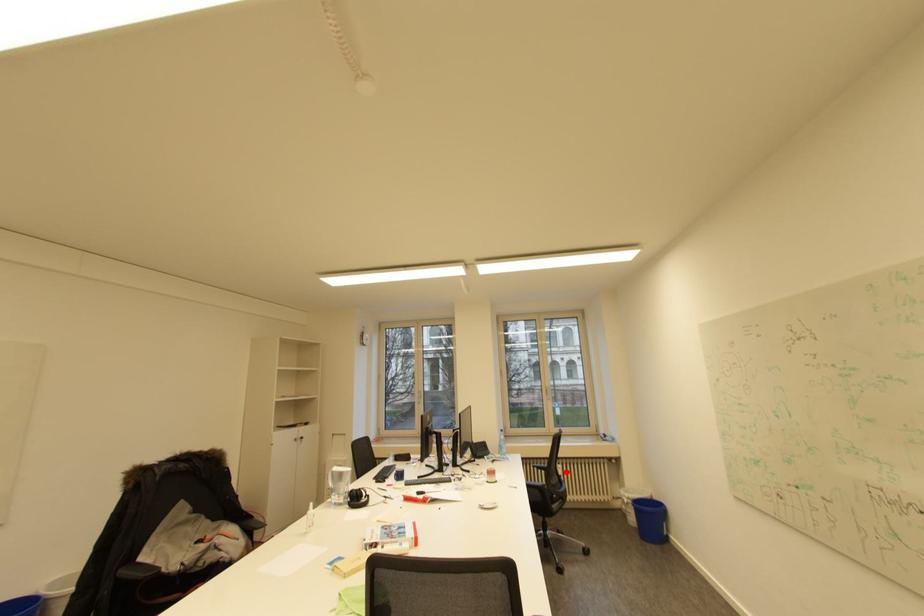
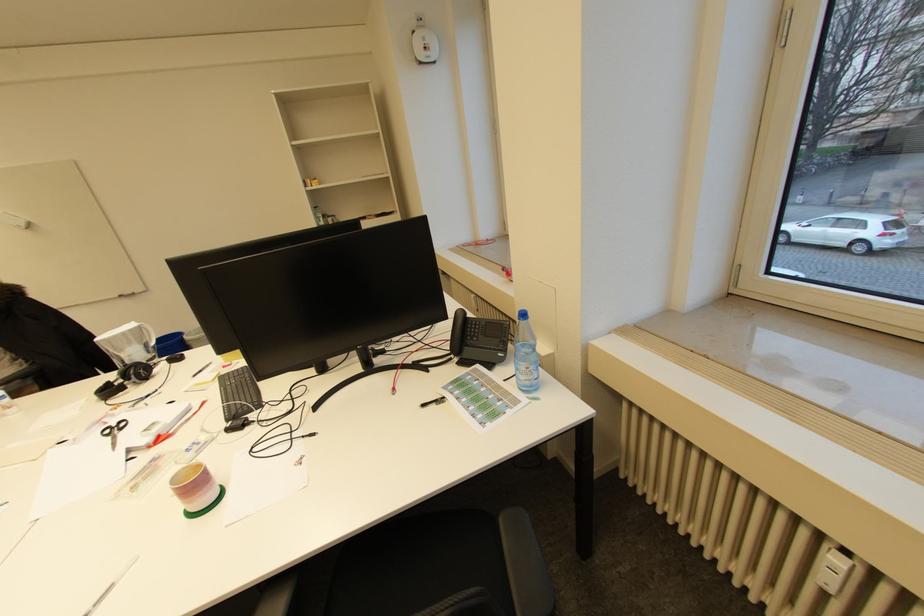
Question: I am providing you with two images of the same scene from different viewpoints. In image1, a red point is highlighted. Considering the same 3D point in image2, which of the following is correct?

Choices:
 (A) It is closer
 (B) It is farther

Answer: (A)